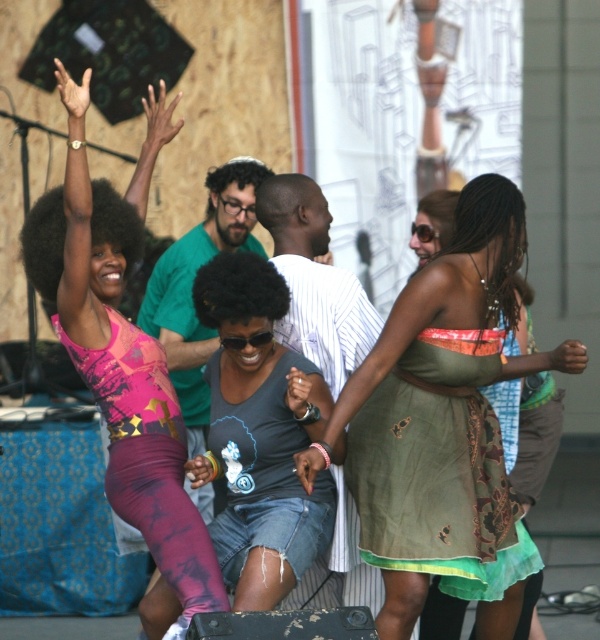
You are a photographer at the event and want to capture both the green textured dress at center and the pink mesh tank top at upper left in the same frame. Which of the two clothing items should you focus on first to ensure they both fit well in your shot?

The green textured dress at center is smaller in size compared to the pink mesh tank top at upper left. To ensure both fit well in the frame, focus on the larger pink mesh tank top at upper left first, then adjust the shot to include the smaller green textured dress at center.

You are a photographer trying to capture a photo of the green textured dress at center and denim shorts at center. If you want to ensure both are fully visible in the frame, which one should you focus on to avoid cropping either?

The green textured dress at center is wider than denim shorts at center, so focusing on the wider green textured dress at center would ensure both are fully visible without cropping.

In the scene shown: You are a photographer trying to capture the dancer in the pink mesh tank top at upper left. You notice a point at coordinates (x=122, y=356) in the image. Is this point located on the pink mesh tank top at upper left?

Yes, the point at coordinates (x=122, y=356) is located on the pink mesh tank top at upper left.